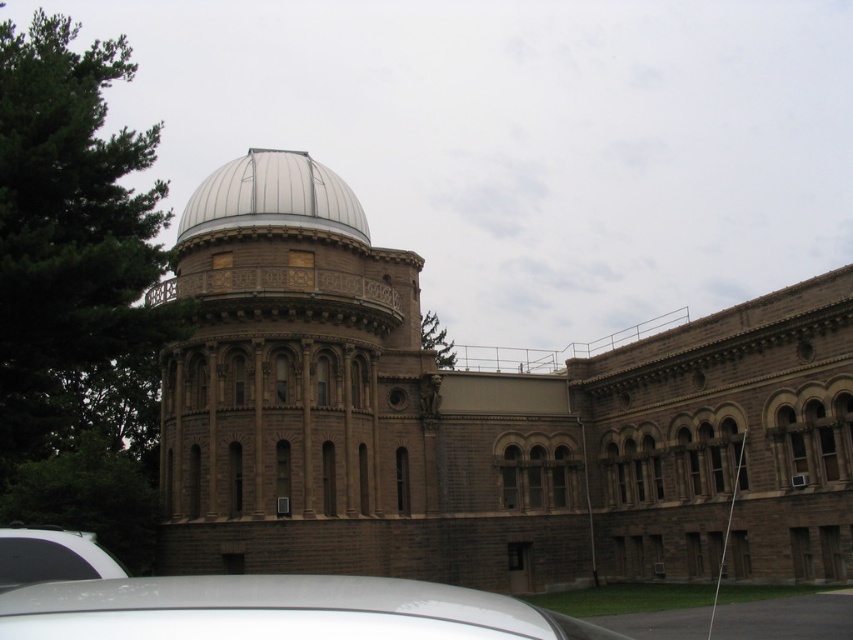
Question: Can you confirm if white glossy car at lower center is positioned to the left of white glossy car at lower left?

Choices:
 (A) yes
 (B) no

Answer: (B)

Question: Based on their relative distances, which object is farther from the white glossy car at lower left?

Choices:
 (A) white glossy car at lower center
 (B) white matte dome at upper center

Answer: (B)

Question: Is white glossy car at lower center above white matte dome at upper center?

Choices:
 (A) no
 (B) yes

Answer: (A)

Question: Which object is closer to the camera taking this photo?

Choices:
 (A) white glossy car at lower center
 (B) white glossy car at lower left
 (C) white matte dome at upper center
 (D) brown stone tower at center

Answer: (A)

Question: Does brown stone tower at center have a smaller size compared to white glossy car at lower center?

Choices:
 (A) yes
 (B) no

Answer: (A)

Question: Among these objects, which one is farthest from the camera?

Choices:
 (A) white glossy car at lower left
 (B) white glossy car at lower center
 (C) brown stone tower at center

Answer: (C)